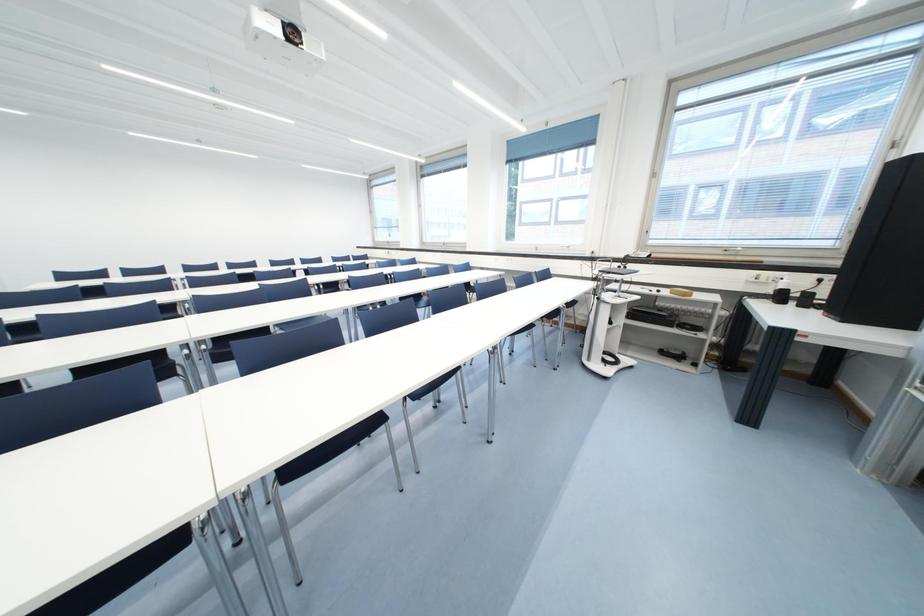
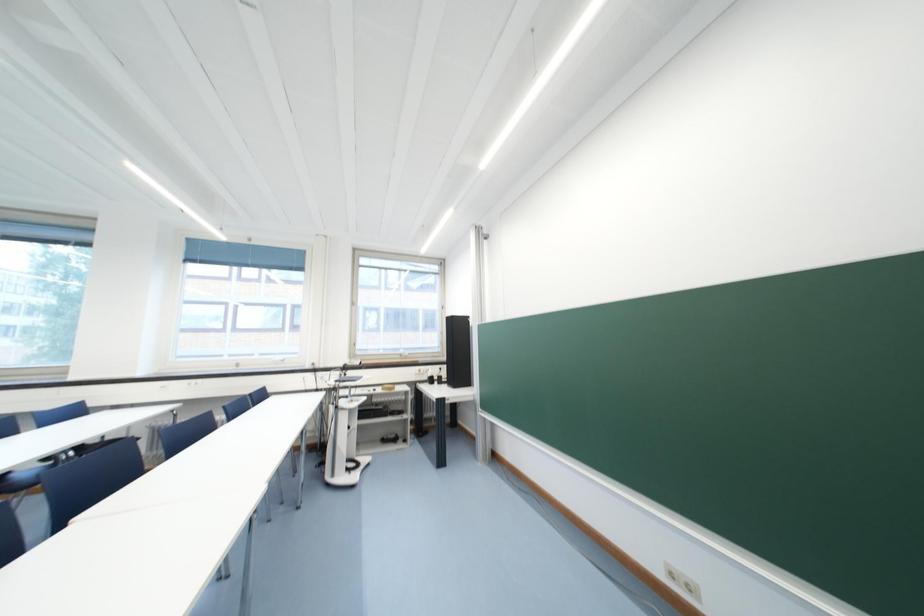
Question: Based on the continuous images, in which direction is the camera rotating? Reply with the corresponding letter.

Choices:
 (A) Left
 (B) Right
 (C) Up
 (D) Down

Answer: (B)